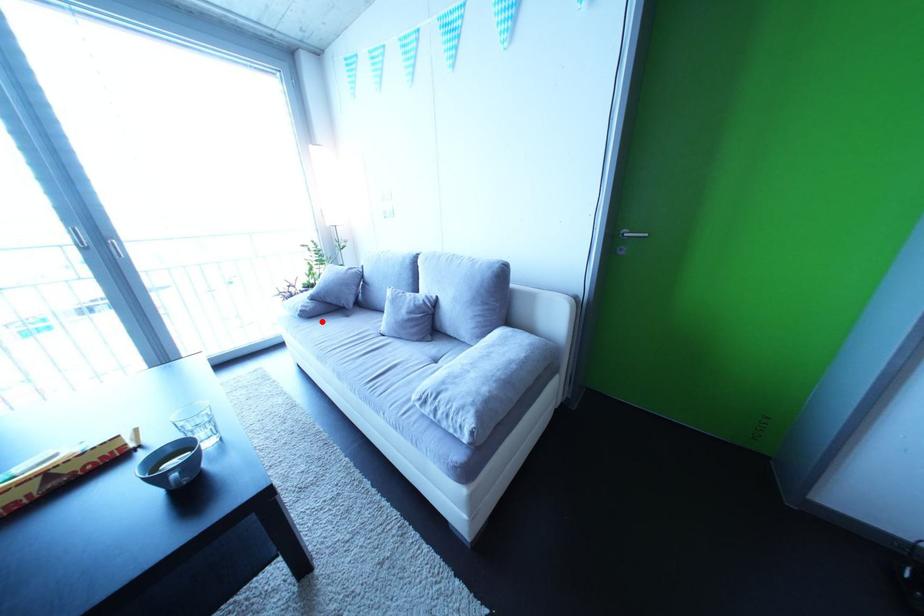
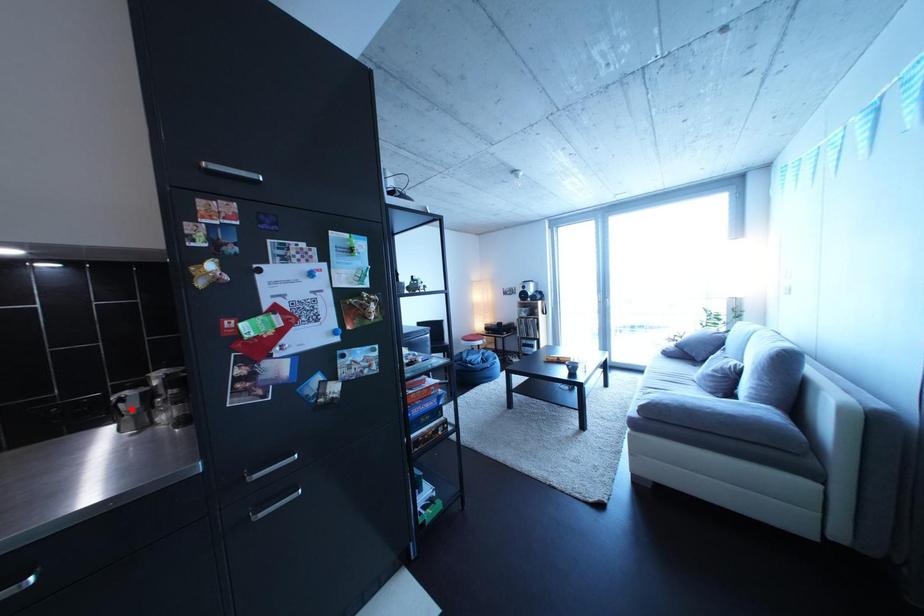
I am providing you with two images of the same scene from different viewpoints. A red point is marked on the first image and another point is marked on the second image. Are the points marked in image1 and image2 representing the same 3D position?

No